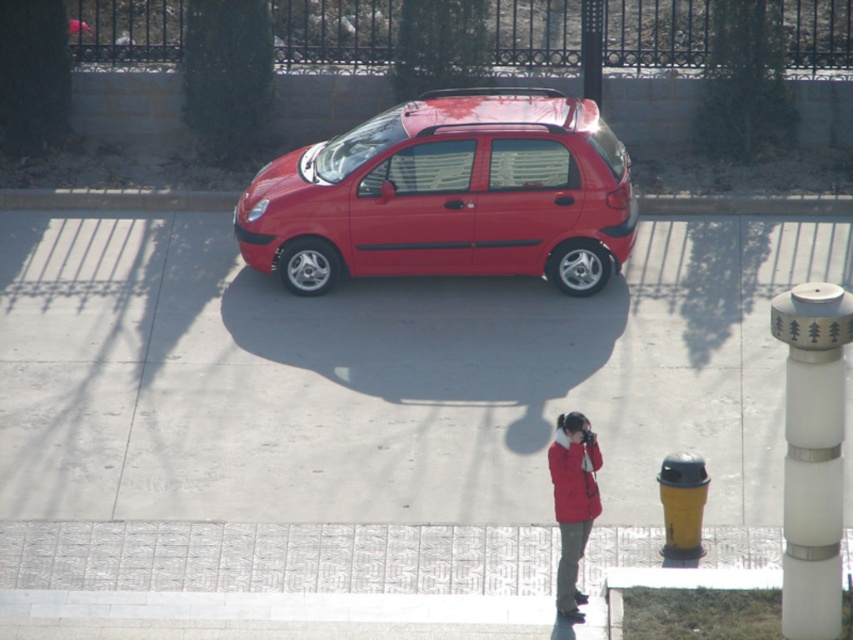
You are standing at the point marked by the coordinates point (115, 198). What is located exactly at that point?

At point (115, 198) lies smooth concrete curb at center.

You are standing on the smooth concrete pavement at center and want to take a photo of the glossy red car at center. Which direction should you face to ensure the car is in your camera frame?

Since the smooth concrete pavement at center is located below the glossy red car at center, you should look upward to capture the glossy red car at center in your camera frame.